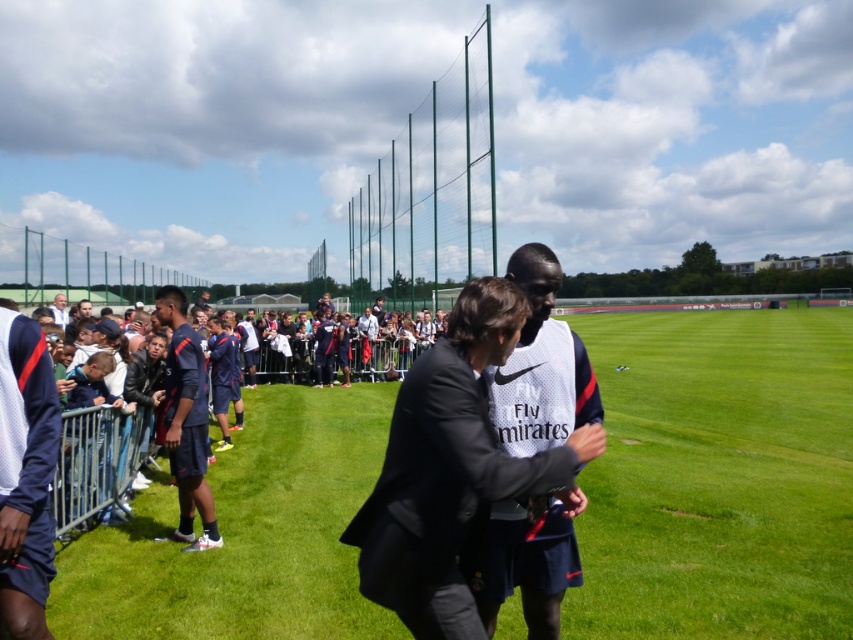
Where is the white mesh jersey at center located in the image?

The white mesh jersey at center is located at point 0.573 on the x axis and 0.635 on the y axis.

You are a photographer positioned at the edge of the sports field. You need to capture a photo that includes both the green grass at center and the white mesh jersey at center. Based on their positions, which object should you adjust your camera angle to focus on first to ensure both are in frame?

The green grass at center is to the right of the white mesh jersey at center. To include both in the frame, adjust your camera angle to focus on the white mesh jersey at center first, then pan slightly to the right to include the green grass at center.